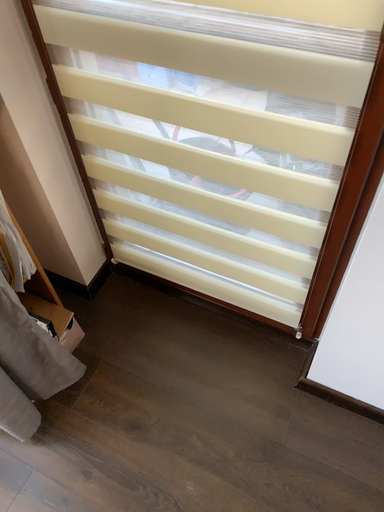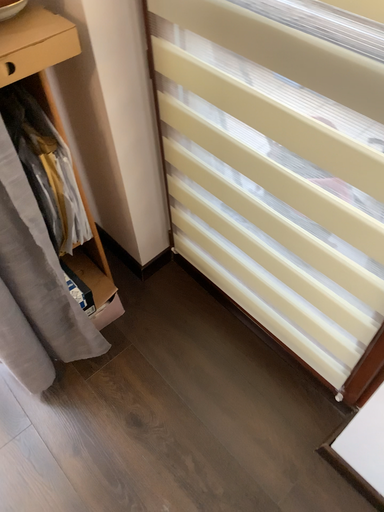
Question: Which way did the camera rotate in the video?

Choices:
 (A) rotated left
 (B) rotated right

Answer: (A)